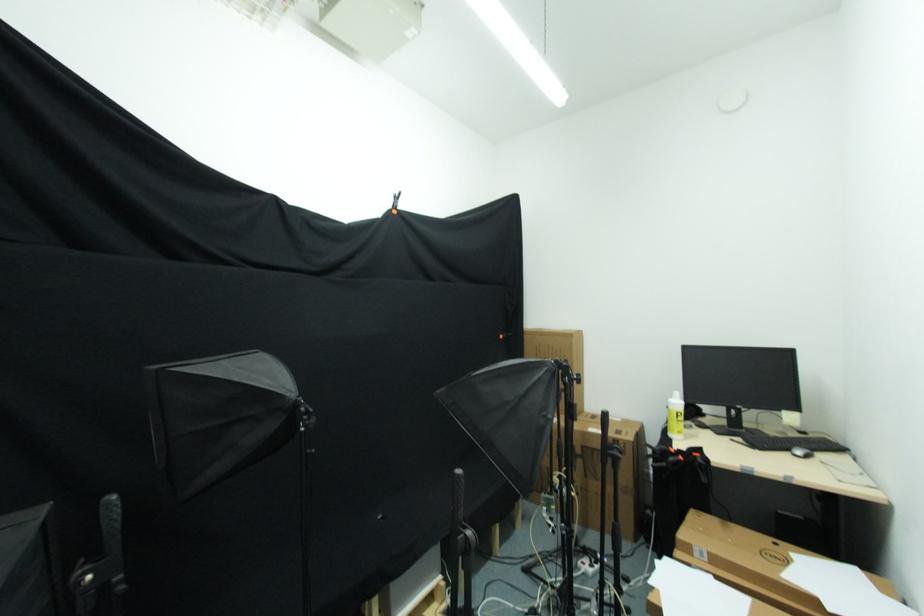
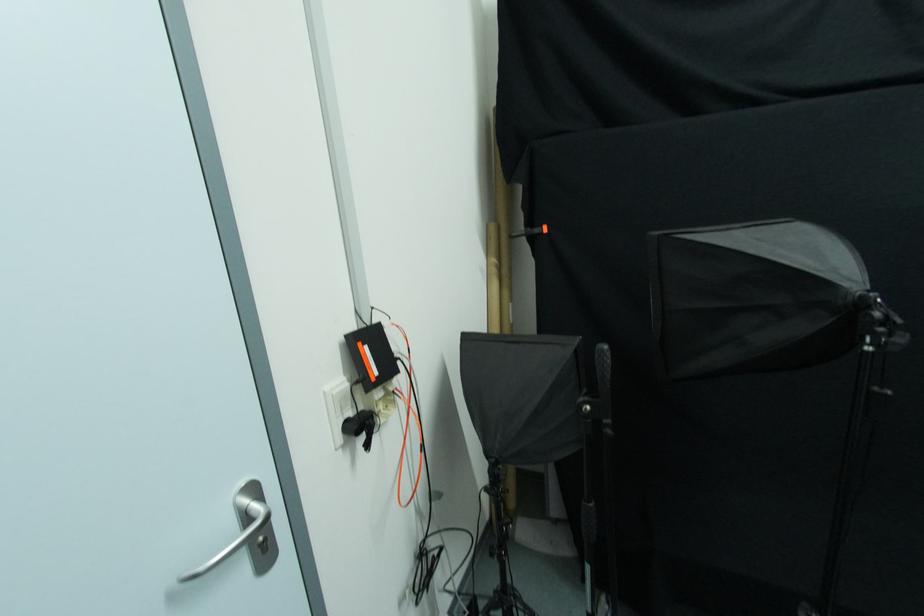
Question: The images are taken continuously from a first-person perspective. In which direction is your viewpoint rotating?

Choices:
 (A) Left
 (B) Right
 (C) Up
 (D) Down

Answer: (A)